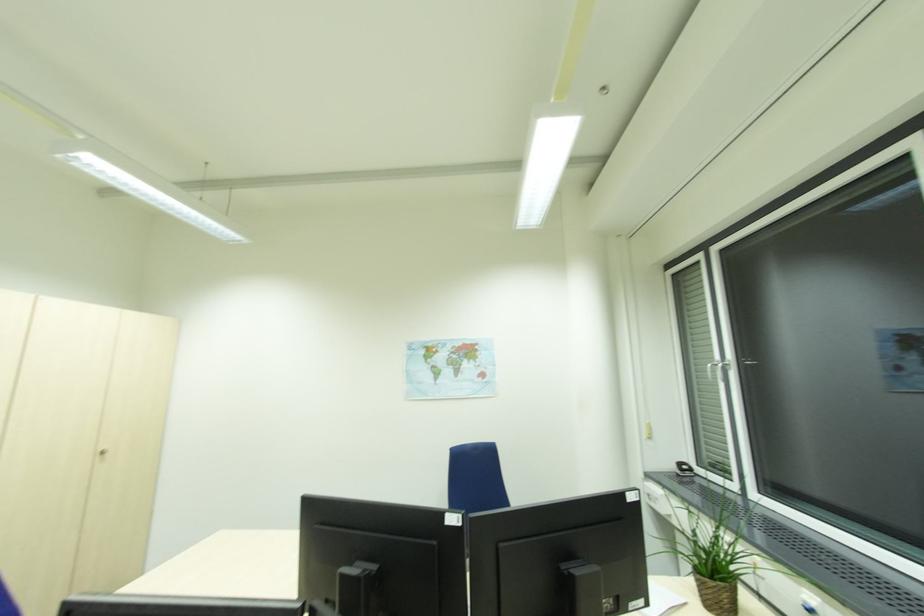
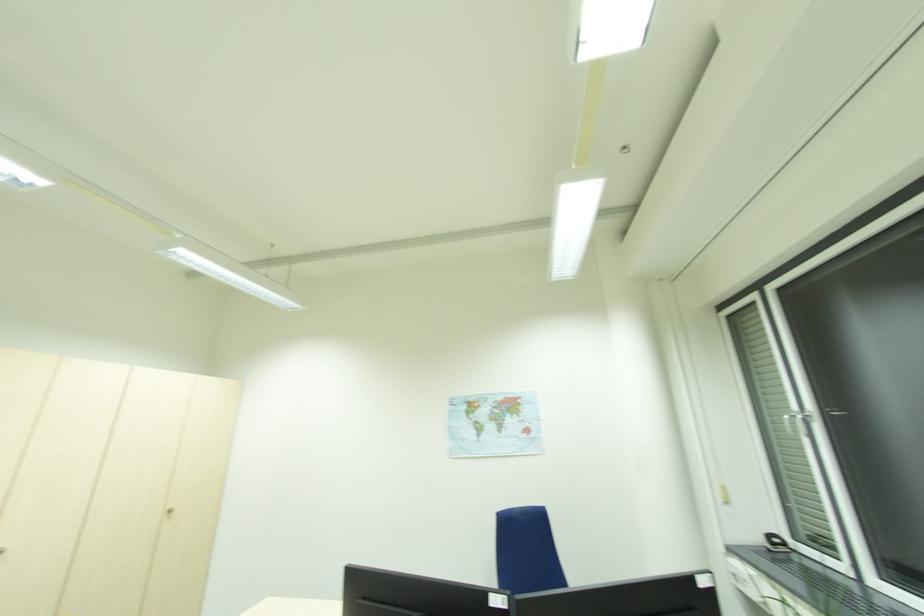
What movement of the cameraman would produce the second image?

The movement direction of the cameraman is right, backward.